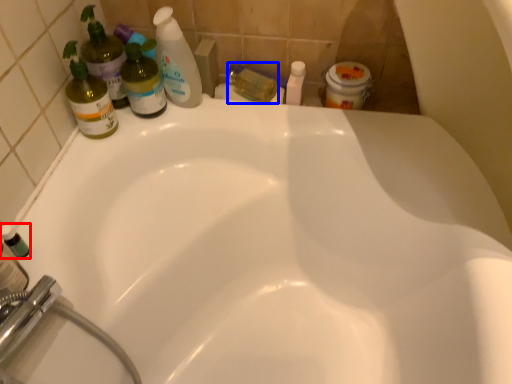
Question: Which object is further to the camera taking this photo, mouthwash (highlighted by a red box) or toiletry (highlighted by a blue box)?

Choices:
 (A) mouthwash
 (B) toiletry

Answer: (B)